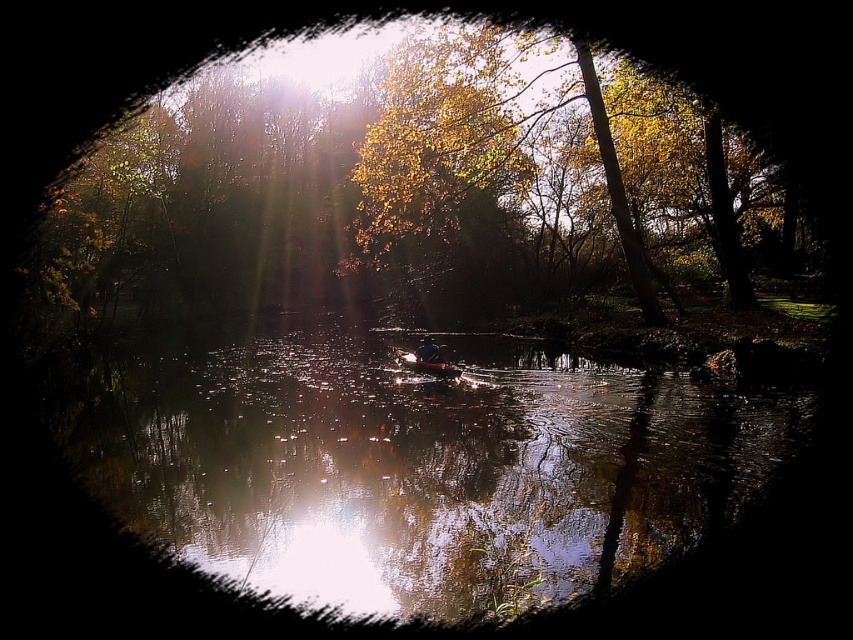
Question: Which object appears closest to the camera in this image?

Choices:
 (A) glossy reflective water at center
 (B) yellow leafy tree at center

Answer: (A)

Question: Can you confirm if glossy reflective water at center is positioned to the right of yellow leafy tree at center?

Choices:
 (A) yes
 (B) no

Answer: (A)

Question: Which point is closer to the camera taking this photo?

Choices:
 (A) (512, 74)
 (B) (259, 412)

Answer: (B)

Question: Can you confirm if glossy reflective water at center is thinner than yellow leafy tree at center?

Choices:
 (A) no
 (B) yes

Answer: (B)

Question: Is glossy reflective water at center above yellow leafy tree at center?

Choices:
 (A) no
 (B) yes

Answer: (A)

Question: Among these points, which one is farthest from the camera?

Choices:
 (A) (415, 48)
 (B) (502, 563)

Answer: (A)